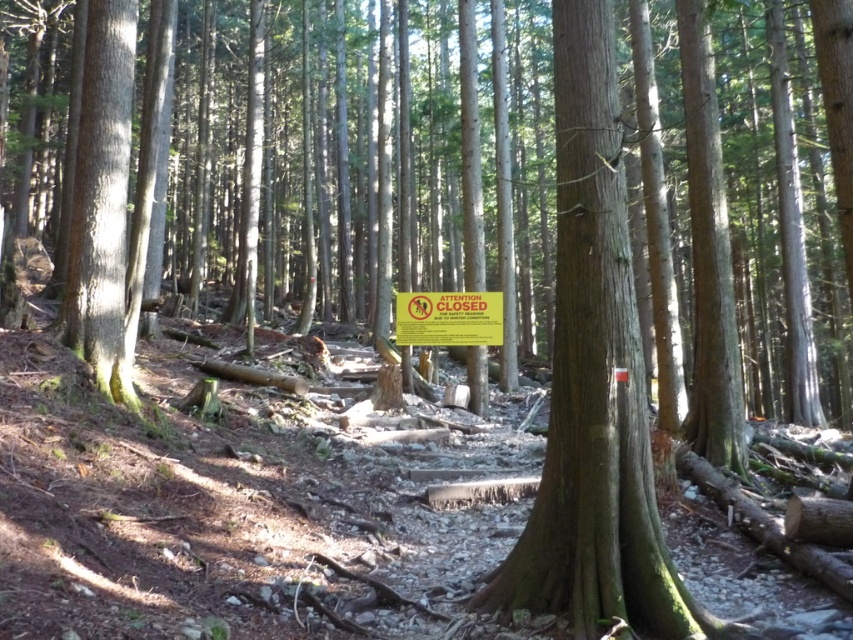
Question: Can you confirm if smooth brown tree trunk at center is positioned to the right of yellow paper sign at center?

Choices:
 (A) no
 (B) yes

Answer: (B)

Question: Is the position of smooth brown tree trunk at center more distant than that of yellow paper sign at center?

Choices:
 (A) no
 (B) yes

Answer: (A)

Question: Is smooth brown tree trunk at center thinner than yellow paper sign at center?

Choices:
 (A) yes
 (B) no

Answer: (A)

Question: Which point is closer to the camera?

Choices:
 (A) yellow paper sign at center
 (B) smooth brown tree trunk at center

Answer: (B)